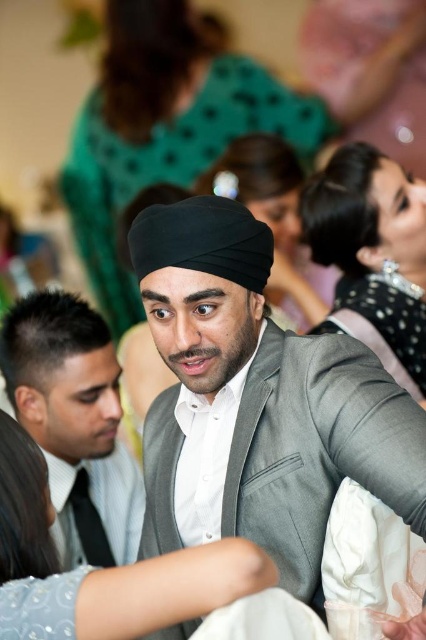
Question: Which point is closer to the camera taking this photo?

Choices:
 (A) 8,349
 (B) 206,285

Answer: (B)

Question: Can you confirm if matte black turban at center is positioned above matte gray suit at center?

Choices:
 (A) no
 (B) yes

Answer: (B)

Question: Does matte black turban at center appear on the left side of matte gray suit at center?

Choices:
 (A) no
 (B) yes

Answer: (A)

Question: Does matte black turban at center appear on the right side of matte gray suit at center?

Choices:
 (A) no
 (B) yes

Answer: (B)